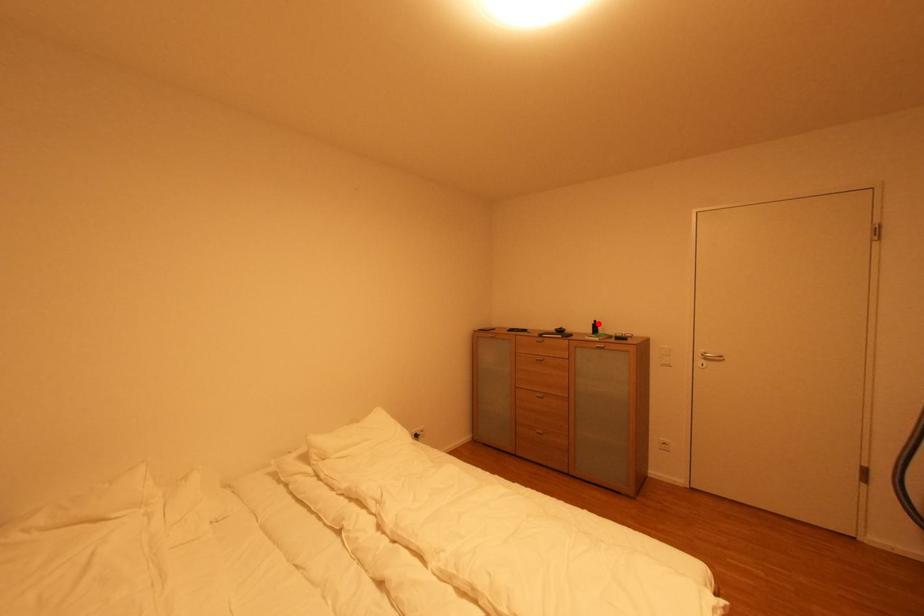
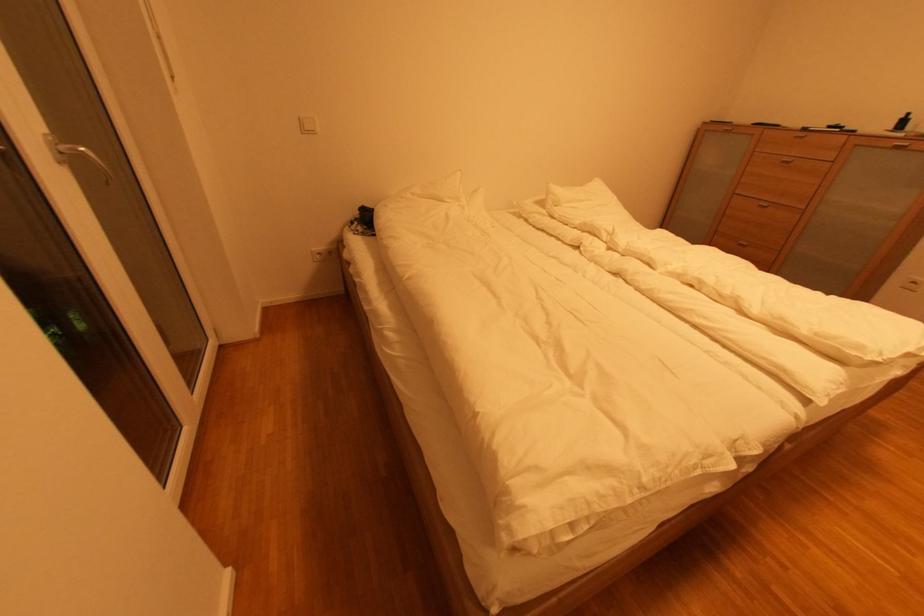
Question: I am providing you with two images of the same scene from different viewpoints. Image1 has a red point marked. In image2, the corresponding 3D location appears at what relative position? Reply with the corresponding letter.

Choices:
 (A) Closer
 (B) Farther

Answer: (B)